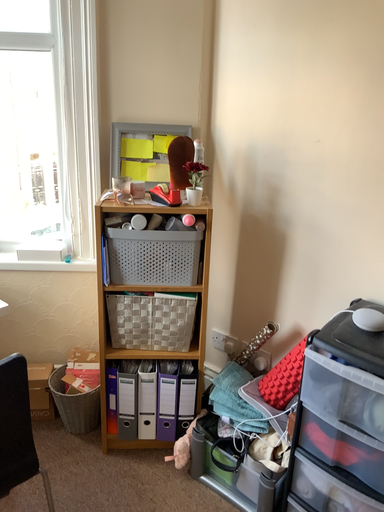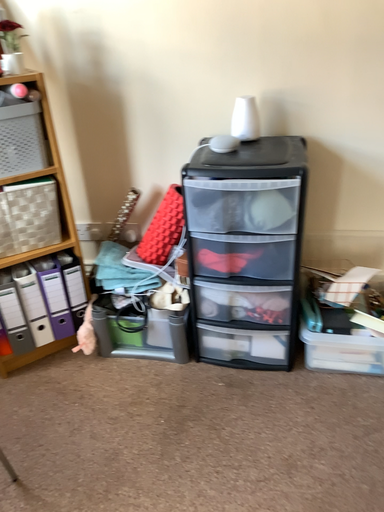
Question: Which way did the camera rotate in the video?

Choices:
 (A) rotated left
 (B) rotated right

Answer: (B)